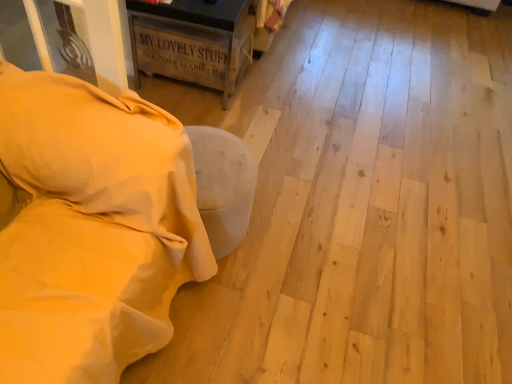
The width and height of the screenshot is (512, 384). What do you see at coordinates (92, 229) in the screenshot? I see `beige fabric ottoman at lower left, which ranks as the second furniture in top-to-bottom order` at bounding box center [92, 229].

Find the location of a particular element. Image resolution: width=512 pixels, height=384 pixels. rustic wood crate at upper left, which is the 2th furniture from bottom to top is located at coordinates (193, 41).

You are a GUI agent. You are given a task and a screenshot of the screen. Output one action in this format:
    pyautogui.click(x=<x>, y=<y>)
    Task: Click on the beige fabric ottoman at lower left, which ranks as the second furniture in top-to-bottom order
    The image size is (512, 384).
    Given the screenshot: What is the action you would take?
    pyautogui.click(x=92, y=229)

Find the location of a particular element. This screenshot has height=384, width=512. pillow behind the beige fabric ottoman at lower left, positioned as the 1th furniture in bottom-to-top order is located at coordinates coord(99,154).

How different are the orientations of beige fabric ottoman at lower left, which ranks as the second furniture in top-to-bottom order, and beige soft pillow at left in degrees?

84.7 degrees separate the facing orientations of beige fabric ottoman at lower left, which ranks as the second furniture in top-to-bottom order, and beige soft pillow at left.

Could you tell me if beige fabric ottoman at lower left, which ranks as the second furniture in top-to-bottom order, is facing beige soft pillow at left?

No, beige fabric ottoman at lower left, which ranks as the second furniture in top-to-bottom order, does not turn towards beige soft pillow at left.

Is beige fabric ottoman at lower left, the second furniture when ordered from back to front, at the left side of beige soft pillow at left?

No.

How far apart are rustic wood crate at upper left, which is the 2th furniture from bottom to top, and beige fabric ottoman at lower left, the first furniture in the front-to-back sequence?

3.69 feet.

The width and height of the screenshot is (512, 384). I want to click on furniture that appears behind the beige fabric ottoman at lower left, which ranks as the second furniture in top-to-bottom order, so click(193, 41).

Would you say rustic wood crate at upper left, which is counted as the 2th furniture, starting from the front, is to the left or to the right of beige fabric ottoman at lower left, positioned as the 1th furniture in bottom-to-top order, in the picture?

Based on their positions, rustic wood crate at upper left, which is counted as the 2th furniture, starting from the front, is located to the right of beige fabric ottoman at lower left, positioned as the 1th furniture in bottom-to-top order.

Which of these two, rustic wood crate at upper left, which is the 2th furniture from bottom to top, or beige fabric ottoman at lower left, which ranks as the second furniture in top-to-bottom order, is bigger?

With larger size is beige fabric ottoman at lower left, which ranks as the second furniture in top-to-bottom order.

From a real-world perspective, between rustic wood crate at upper left, which is the 2th furniture from bottom to top, and beige soft pillow at left, who is vertically higher?

beige soft pillow at left.

Is rustic wood crate at upper left, which is counted as the first furniture, starting from the back, completely or partially outside of beige soft pillow at left?

Absolutely, rustic wood crate at upper left, which is counted as the first furniture, starting from the back, is external to beige soft pillow at left.

Considering the points (248, 46) and (91, 170), which point is behind, point (248, 46) or point (91, 170)?

Point (248, 46)

Can you confirm if rustic wood crate at upper left, which is the 2th furniture from bottom to top, is positioned to the left of beige soft pillow at left?

No.

From a real-world perspective, is beige soft pillow at left positioned over rustic wood crate at upper left, which is counted as the 2th furniture, starting from the front, based on gravity?

Yes, from a real-world perspective, beige soft pillow at left is above rustic wood crate at upper left, which is counted as the 2th furniture, starting from the front.

Is beige soft pillow at left further to the viewer compared to rustic wood crate at upper left, which is counted as the 2th furniture, starting from the front?

No, beige soft pillow at left is closer to the viewer.

Is beige soft pillow at left not within rustic wood crate at upper left, which is the first furniture from top to bottom?

Yes, beige soft pillow at left is outside of rustic wood crate at upper left, which is the first furniture from top to bottom.

Is beige soft pillow at left far away from rustic wood crate at upper left, which is counted as the first furniture, starting from the back?

That's right, there is a large distance between beige soft pillow at left and rustic wood crate at upper left, which is counted as the first furniture, starting from the back.

Which point is more forward, [159,202] or [135,12]?

Positioned in front is point [159,202].

From a real-world perspective, is beige fabric ottoman at lower left, positioned as the 1th furniture in bottom-to-top order, positioned over rustic wood crate at upper left, which is counted as the 2th furniture, starting from the front, based on gravity?

Indeed, from a real-world perspective, beige fabric ottoman at lower left, positioned as the 1th furniture in bottom-to-top order, stands above rustic wood crate at upper left, which is counted as the 2th furniture, starting from the front.

Considering the sizes of beige fabric ottoman at lower left, the second furniture when ordered from back to front, and rustic wood crate at upper left, which is counted as the 2th furniture, starting from the front, in the image, is beige fabric ottoman at lower left, the second furniture when ordered from back to front, taller or shorter than rustic wood crate at upper left, which is counted as the 2th furniture, starting from the front,?

In the image, beige fabric ottoman at lower left, the second furniture when ordered from back to front, appears to be taller than rustic wood crate at upper left, which is counted as the 2th furniture, starting from the front.

Looking at this image, how much distance is there between beige soft pillow at left and beige fabric ottoman at lower left, the first furniture in the front-to-back sequence?

A distance of 2.10 inches exists between beige soft pillow at left and beige fabric ottoman at lower left, the first furniture in the front-to-back sequence.

Who is taller, beige soft pillow at left or beige fabric ottoman at lower left, the first furniture in the front-to-back sequence?

beige fabric ottoman at lower left, the first furniture in the front-to-back sequence, is taller.

Which of these two, beige soft pillow at left or beige fabric ottoman at lower left, which ranks as the second furniture in top-to-bottom order, is smaller?

beige soft pillow at left.

From a real-world perspective, is beige soft pillow at left located beneath beige fabric ottoman at lower left, the first furniture in the front-to-back sequence?

Actually, beige soft pillow at left is physically above beige fabric ottoman at lower left, the first furniture in the front-to-back sequence, in the real world.

Image resolution: width=512 pixels, height=384 pixels. There is a beige fabric ottoman at lower left, positioned as the 1th furniture in bottom-to-top order. Find the location of `pillow above it (from a real-world perspective)`. pillow above it (from a real-world perspective) is located at coordinates (99, 154).

Locate an element on the screen. furniture behind the beige fabric ottoman at lower left, which ranks as the second furniture in top-to-bottom order is located at coordinates (193, 41).

From the image, which object appears to be farther from rustic wood crate at upper left, which is counted as the first furniture, starting from the back, beige fabric ottoman at lower left, positioned as the 1th furniture in bottom-to-top order, or beige soft pillow at left?

The object further to rustic wood crate at upper left, which is counted as the first furniture, starting from the back, is beige fabric ottoman at lower left, positioned as the 1th furniture in bottom-to-top order.

Looking at the image, which one is located further to rustic wood crate at upper left, which is counted as the first furniture, starting from the back, beige soft pillow at left or beige fabric ottoman at lower left, positioned as the 1th furniture in bottom-to-top order?

beige fabric ottoman at lower left, positioned as the 1th furniture in bottom-to-top order, is positioned further to the anchor rustic wood crate at upper left, which is counted as the first furniture, starting from the back.

Considering their positions, is rustic wood crate at upper left, which is the first furniture from top to bottom, positioned closer to beige fabric ottoman at lower left, the first furniture in the front-to-back sequence, than beige soft pillow at left?

beige soft pillow at left lies closer to beige fabric ottoman at lower left, the first furniture in the front-to-back sequence, than the other object.

Based on their spatial positions, is beige fabric ottoman at lower left, the second furniture when ordered from back to front, or rustic wood crate at upper left, which is counted as the first furniture, starting from the back, closer to beige soft pillow at left?

beige fabric ottoman at lower left, the second furniture when ordered from back to front.

Estimate the real-world distances between objects in this image. Which object is closer to beige soft pillow at left, rustic wood crate at upper left, which is counted as the 2th furniture, starting from the front, or beige fabric ottoman at lower left, the first furniture in the front-to-back sequence?

beige fabric ottoman at lower left, the first furniture in the front-to-back sequence, is closer to beige soft pillow at left.

From the image, which object appears to be nearer to beige fabric ottoman at lower left, which ranks as the second furniture in top-to-bottom order, beige soft pillow at left or rustic wood crate at upper left, which is the first furniture from top to bottom?

Among the two, beige soft pillow at left is located nearer to beige fabric ottoman at lower left, which ranks as the second furniture in top-to-bottom order.

The width and height of the screenshot is (512, 384). In order to click on pillow between beige fabric ottoman at lower left, the first furniture in the front-to-back sequence, and rustic wood crate at upper left, which is the 2th furniture from bottom to top, from front to back in this screenshot , I will do `click(99, 154)`.